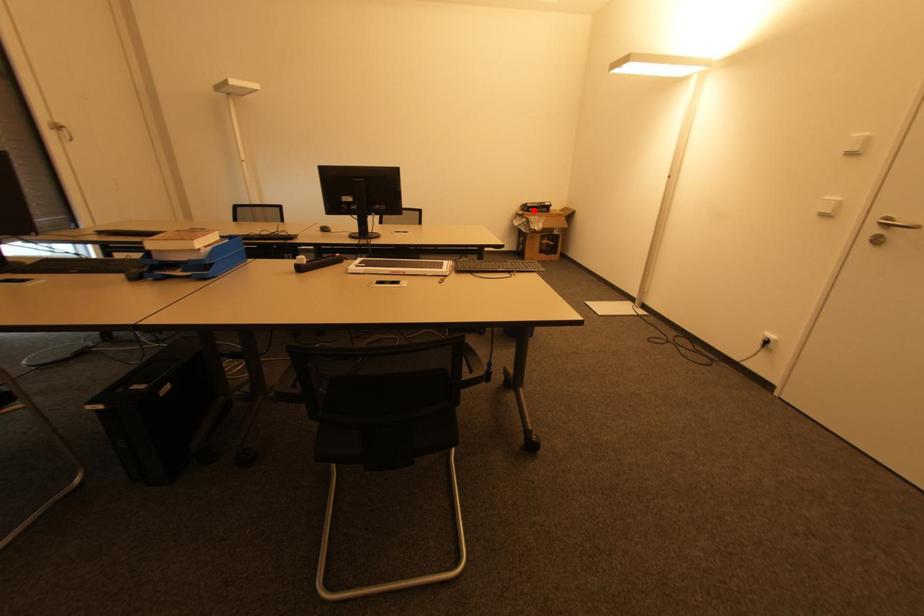
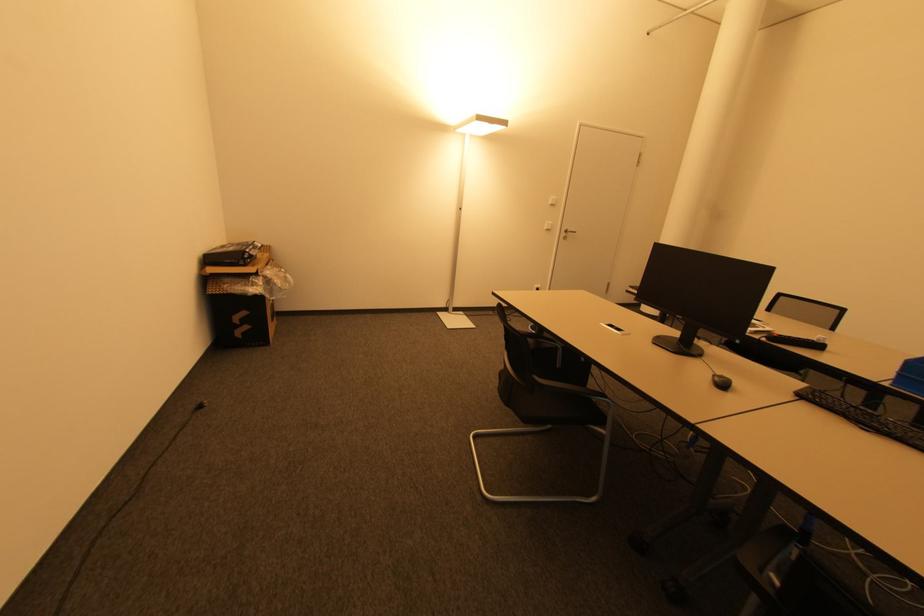
The point at the highlighted location is marked in the first image. Where is the corresponding point in the second image?

(250, 261)